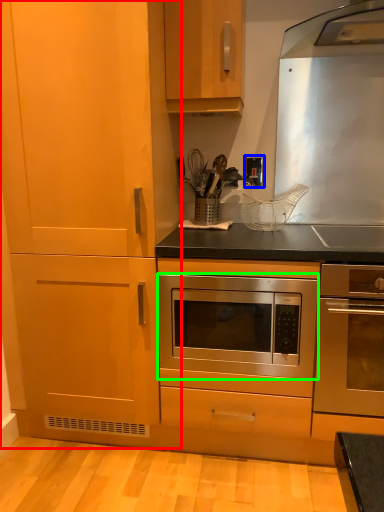
Question: Which object is positioned farthest from cabinetry (highlighted by a red box)? Select from electric outlet (highlighted by a blue box) and oven (highlighted by a green box).

Choices:
 (A) electric outlet
 (B) oven

Answer: (A)